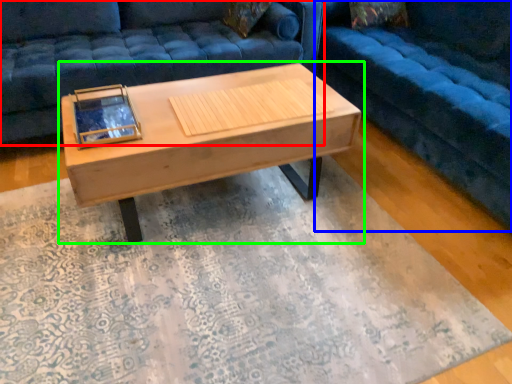
Question: Based on their relative distances, which object is farther from studio couch (highlighted by a red box)? Choose from studio couch (highlighted by a blue box) and coffee table (highlighted by a green box).

Choices:
 (A) studio couch
 (B) coffee table

Answer: (A)